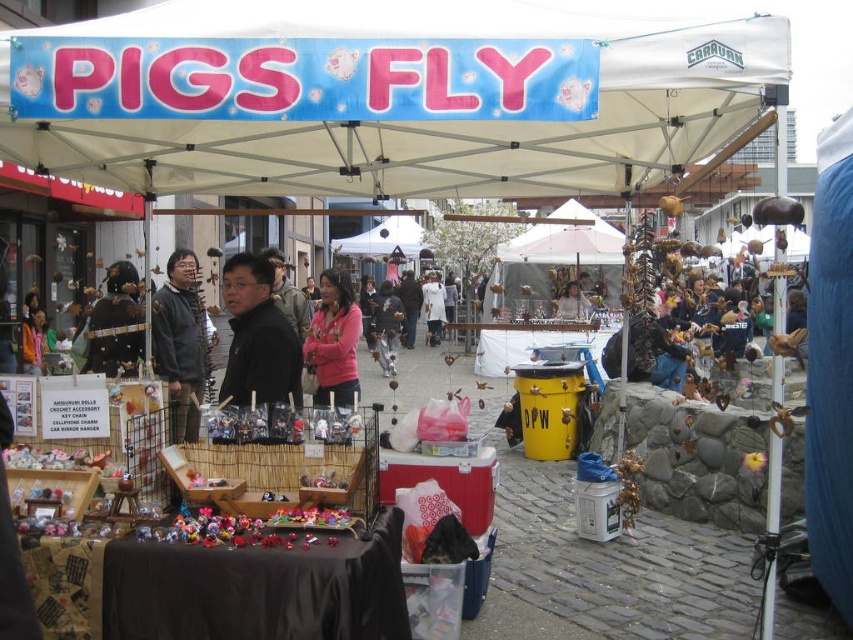
You are standing at the entrance of the market and want to locate the blue fabric canopy at upper center. According to the scene description, where would you look relative to the stalls and other structures?

The blue fabric canopy at upper center is located at the upper center position, which is above and central to the stalls and structures in the market scene.

You are a customer at the outdoor market. You notice the blue fabric canopy at upper center and the black matte jacket at center. Which object is wider?

The blue fabric canopy at upper center is wider than the black matte jacket at center.